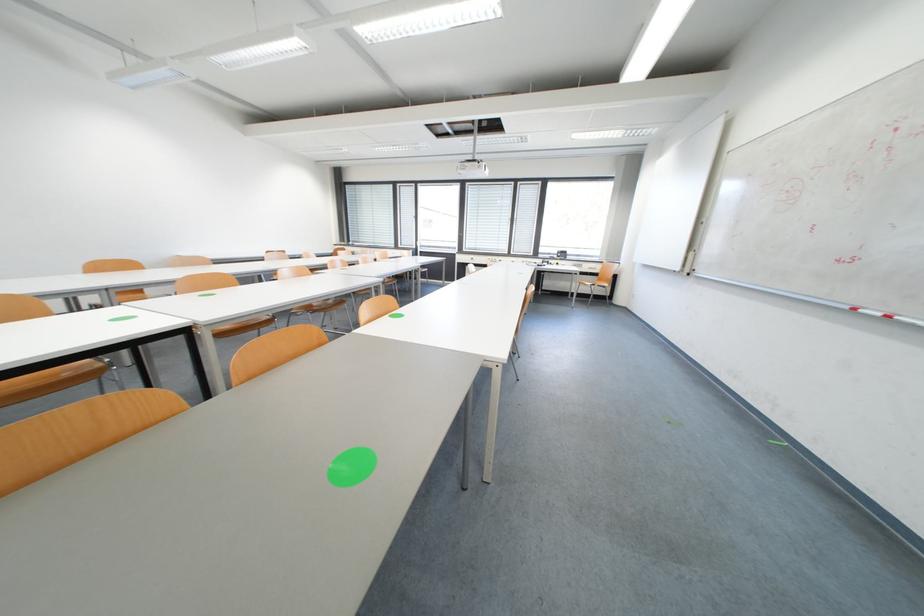
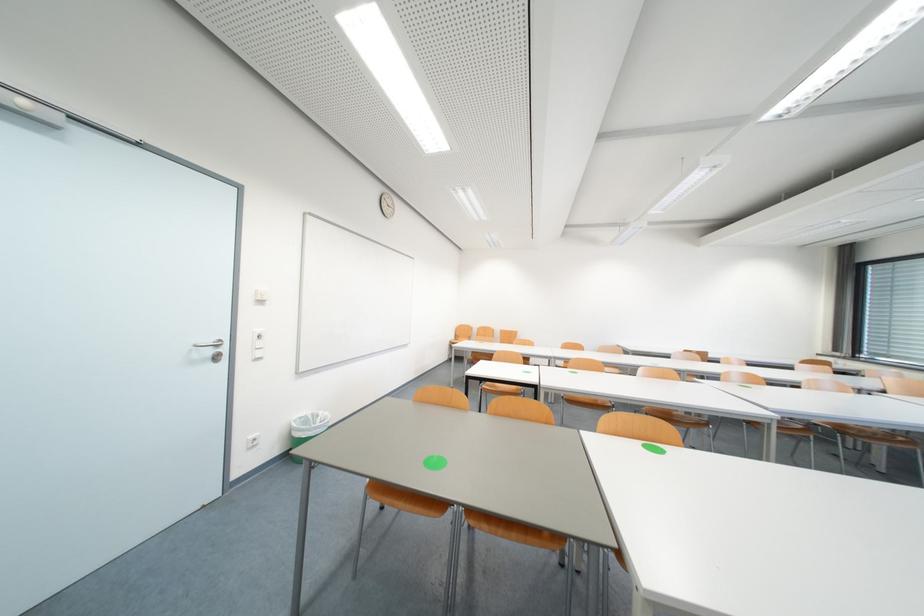
Question: The camera is either moving clockwise (left) or counter-clockwise (right) around the object. The first image is from the beginning of the video and the second image is from the end. Is the camera moving left or right when shooting the video?

Choices:
 (A) Left
 (B) Right

Answer: (B)